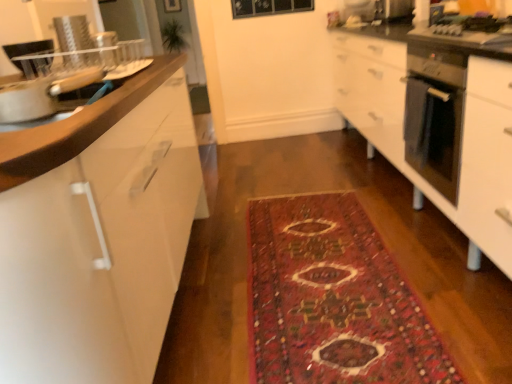
What do you see at coordinates (435, 115) in the screenshot?
I see `satin silver oven at right` at bounding box center [435, 115].

The width and height of the screenshot is (512, 384). What do you see at coordinates (466, 31) in the screenshot?
I see `metallic stainless steel gas stove at right` at bounding box center [466, 31].

The height and width of the screenshot is (384, 512). I want to click on satin silver oven at right, so click(435, 115).

Considering the positions of point (409, 18) and point (102, 159), is point (409, 18) closer or farther from the camera than point (102, 159)?

Point (409, 18) is positioned farther from the camera compared to point (102, 159).

Is metallic stainless steel microwave at upper right spatially inside white glossy cabinet at left, or outside of it?

The correct answer is: outside.

Between metallic stainless steel microwave at upper right and white glossy cabinet at left, which one has larger size?

white glossy cabinet at left.

From the image's perspective, is metallic stainless steel microwave at upper right positioned above or below white glossy cabinet at left?

metallic stainless steel microwave at upper right is situated higher than white glossy cabinet at left in the image.

Considering the positions of objects satin silver oven at right and metallic stainless steel microwave at upper right in the image provided, who is in front, satin silver oven at right or metallic stainless steel microwave at upper right?

satin silver oven at right.

From their relative heights in the image, would you say satin silver oven at right is taller or shorter than metallic stainless steel microwave at upper right?

Considering their sizes, satin silver oven at right has more height than metallic stainless steel microwave at upper right.

Could you measure the distance between satin silver oven at right and metallic stainless steel microwave at upper right?

The distance of satin silver oven at right from metallic stainless steel microwave at upper right is 1.22 meters.

Locate an element on the screen. appliance behind the satin silver oven at right is located at coordinates (394, 10).

From a real-world perspective, which is physically below, metallic stainless steel gas stove at right or metallic stainless steel microwave at upper right?

metallic stainless steel gas stove at right.

Who is smaller, metallic stainless steel gas stove at right or metallic stainless steel microwave at upper right?

metallic stainless steel microwave at upper right.

From the image's perspective, is metallic stainless steel gas stove at right above metallic stainless steel microwave at upper right?

No, from the image's perspective, metallic stainless steel gas stove at right is not above metallic stainless steel microwave at upper right.

Is metallic stainless steel gas stove at right to the right of metallic stainless steel microwave at upper right from the viewer's perspective?

No, metallic stainless steel gas stove at right is not to the right of metallic stainless steel microwave at upper right.

Which of these two, carpeted rug at center or metallic stainless steel microwave at upper right, is smaller?

Smaller between the two is metallic stainless steel microwave at upper right.

Are carpeted rug at center and metallic stainless steel microwave at upper right located far from each other?

Yes.

Is carpeted rug at center located outside metallic stainless steel microwave at upper right?

carpeted rug at center is positioned outside metallic stainless steel microwave at upper right.

Does carpeted rug at center have a lesser width compared to metallic stainless steel microwave at upper right?

In fact, carpeted rug at center might be wider than metallic stainless steel microwave at upper right.

Would you say metallic stainless steel microwave at upper right is inside or outside satin silver oven at right?

metallic stainless steel microwave at upper right is located beyond the bounds of satin silver oven at right.

The height and width of the screenshot is (384, 512). In the image, there is a metallic stainless steel microwave at upper right. In order to click on home appliance below it (from a real-world perspective) in this screenshot , I will do `click(435, 115)`.

Measure the distance from metallic stainless steel microwave at upper right to satin silver oven at right.

They are 3.99 feet apart.

Which is more to the right, metallic stainless steel microwave at upper right or satin silver oven at right?

Positioned to the right is metallic stainless steel microwave at upper right.

Is carpeted rug at center not within white glossy cabinet at left?

Yes, carpeted rug at center is located beyond the bounds of white glossy cabinet at left.

From the image's perspective, who appears lower, carpeted rug at center or white glossy cabinet at left?

carpeted rug at center.

Which is in front, carpeted rug at center or white glossy cabinet at left?

white glossy cabinet at left is in front.

Between carpeted rug at center and white glossy cabinet at left, which one has smaller width?

Thinner between the two is white glossy cabinet at left.

From the image's perspective, between metallic stainless steel microwave at upper right and metallic stainless steel gas stove at right, which one is located above?

From the image's view, metallic stainless steel microwave at upper right is above.

Considering the sizes of objects metallic stainless steel microwave at upper right and metallic stainless steel gas stove at right in the image provided, who is shorter, metallic stainless steel microwave at upper right or metallic stainless steel gas stove at right?

With less height is metallic stainless steel gas stove at right.

Is metallic stainless steel microwave at upper right thinner than metallic stainless steel gas stove at right?

Indeed, metallic stainless steel microwave at upper right has a lesser width compared to metallic stainless steel gas stove at right.

How distant is metallic stainless steel microwave at upper right from metallic stainless steel gas stove at right?

They are 1.20 meters apart.

The height and width of the screenshot is (384, 512). In order to click on appliance lying above the white glossy cabinet at left (from the image's perspective) in this screenshot , I will do `click(394, 10)`.

Image resolution: width=512 pixels, height=384 pixels. What are the coordinates of `home appliance on the left of metallic stainless steel microwave at upper right` in the screenshot? It's located at (435, 115).

Consider the image. Looking at the image, which one is located closer to carpeted rug at center, satin silver oven at right or metallic stainless steel gas stove at right?

satin silver oven at right is closer to carpeted rug at center.

From the image, which object appears to be nearer to metallic stainless steel microwave at upper right, carpeted rug at center or satin silver oven at right?

satin silver oven at right is closer to metallic stainless steel microwave at upper right.

Considering their positions, is metallic stainless steel microwave at upper right positioned further to carpeted rug at center than metallic stainless steel gas stove at right?

metallic stainless steel microwave at upper right is further to carpeted rug at center.

From the picture: From the image, which object appears to be nearer to carpeted rug at center, metallic stainless steel microwave at upper right or white glossy cabinet at left?

white glossy cabinet at left is closer to carpeted rug at center.

When comparing their distances from metallic stainless steel gas stove at right, does carpeted rug at center or metallic stainless steel microwave at upper right seem further?

metallic stainless steel microwave at upper right is positioned further to the anchor metallic stainless steel gas stove at right.

Looking at this image, which object lies further to the anchor point carpeted rug at center, white glossy cabinet at left or satin silver oven at right?

satin silver oven at right is positioned further to the anchor carpeted rug at center.

Based on their spatial positions, is metallic stainless steel microwave at upper right or white glossy cabinet at left further from satin silver oven at right?

Based on the image, metallic stainless steel microwave at upper right appears to be further to satin silver oven at right.

Looking at the image, which one is located closer to carpeted rug at center, white glossy cabinet at left or metallic stainless steel microwave at upper right?

Among the two, white glossy cabinet at left is located nearer to carpeted rug at center.

I want to click on home appliance positioned between white glossy cabinet at left and metallic stainless steel microwave at upper right from near to far, so click(435, 115).

The image size is (512, 384). In order to click on home appliance located between white glossy cabinet at left and metallic stainless steel gas stove at right in the left-right direction in this screenshot , I will do `click(435, 115)`.

Locate an element on the screen. Image resolution: width=512 pixels, height=384 pixels. gas stove between carpeted rug at center and metallic stainless steel microwave at upper right in the front-back direction is located at coordinates (466, 31).

This screenshot has width=512, height=384. What are the coordinates of `gas stove positioned between white glossy cabinet at left and metallic stainless steel microwave at upper right from near to far` in the screenshot? It's located at (466, 31).